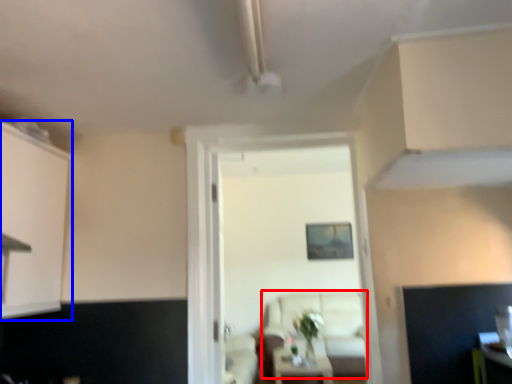
Question: Which object appears closest to the camera in this image, couch (highlighted by a red box) or cabinetry (highlighted by a blue box)?

Choices:
 (A) couch
 (B) cabinetry

Answer: (B)